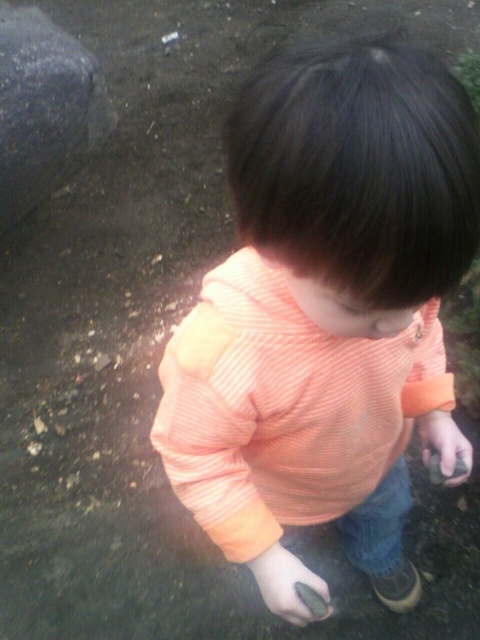
Question: Does smooth gray rock at lower center have a larger size compared to smooth gray rock at lower right?

Choices:
 (A) no
 (B) yes

Answer: (A)

Question: Which point is farther to the camera?

Choices:
 (A) (38, 61)
 (B) (305, 589)
 (C) (458, 476)

Answer: (A)

Question: Which object is positioned farthest from the smooth gray rock at lower right?

Choices:
 (A) smooth gray rock at upper left
 (B) smooth gray rock at lower center
 (C) orange striped shirt at center

Answer: (A)

Question: Is the position of orange striped shirt at center less distant than that of smooth gray rock at lower center?

Choices:
 (A) yes
 (B) no

Answer: (A)

Question: Which object appears closest to the camera in this image?

Choices:
 (A) orange striped shirt at center
 (B) smooth gray rock at lower right
 (C) smooth gray rock at upper left

Answer: (A)

Question: Can you confirm if smooth gray rock at lower center is positioned to the left of smooth gray rock at lower right?

Choices:
 (A) no
 (B) yes

Answer: (B)